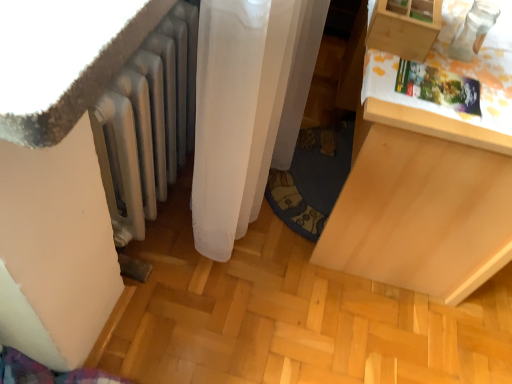
Question: Can you confirm if light wood drawer at right is positioned to the right of silver metallic radiator at lower left?

Choices:
 (A) yes
 (B) no

Answer: (A)

Question: Is light wood drawer at right positioned before silver metallic radiator at lower left?

Choices:
 (A) yes
 (B) no

Answer: (B)

Question: Is light wood drawer at right taller than silver metallic radiator at lower left?

Choices:
 (A) no
 (B) yes

Answer: (B)

Question: Is silver metallic radiator at lower left a part of light wood drawer at right?

Choices:
 (A) yes
 (B) no

Answer: (B)

Question: Can you confirm if light wood drawer at right is wider than silver metallic radiator at lower left?

Choices:
 (A) no
 (B) yes

Answer: (B)

Question: Can you confirm if light wood drawer at right is shorter than silver metallic radiator at lower left?

Choices:
 (A) yes
 (B) no

Answer: (B)

Question: Would you say light wood drawer at right is part of silver metallic radiator at lower left's contents?

Choices:
 (A) yes
 (B) no

Answer: (B)

Question: Is silver metallic radiator at lower left positioned far away from light wood drawer at right?

Choices:
 (A) no
 (B) yes

Answer: (A)

Question: Can you confirm if silver metallic radiator at lower left is shorter than light wood drawer at right?

Choices:
 (A) no
 (B) yes

Answer: (B)

Question: From the image's perspective, is silver metallic radiator at lower left above light wood drawer at right?

Choices:
 (A) yes
 (B) no

Answer: (A)

Question: Can you confirm if silver metallic radiator at lower left is thinner than light wood drawer at right?

Choices:
 (A) no
 (B) yes

Answer: (B)

Question: Is silver metallic radiator at lower left facing away from light wood drawer at right?

Choices:
 (A) yes
 (B) no

Answer: (A)

Question: Does silver metallic radiator at lower left have a lesser width compared to wooden drawer at upper right?

Choices:
 (A) yes
 (B) no

Answer: (A)